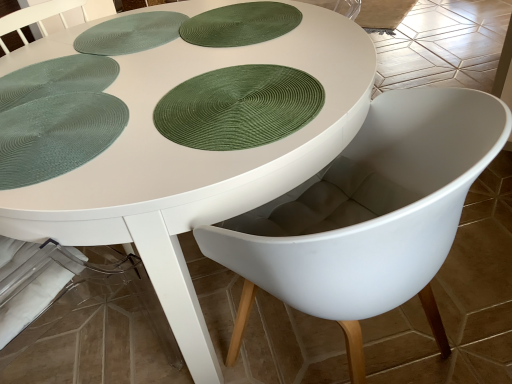
Locate an element on the screen. free space above green textured placemat at left, marked as the first paper plate in a bottom-to-top arrangement (from a real-world perspective) is located at coordinates (52, 130).